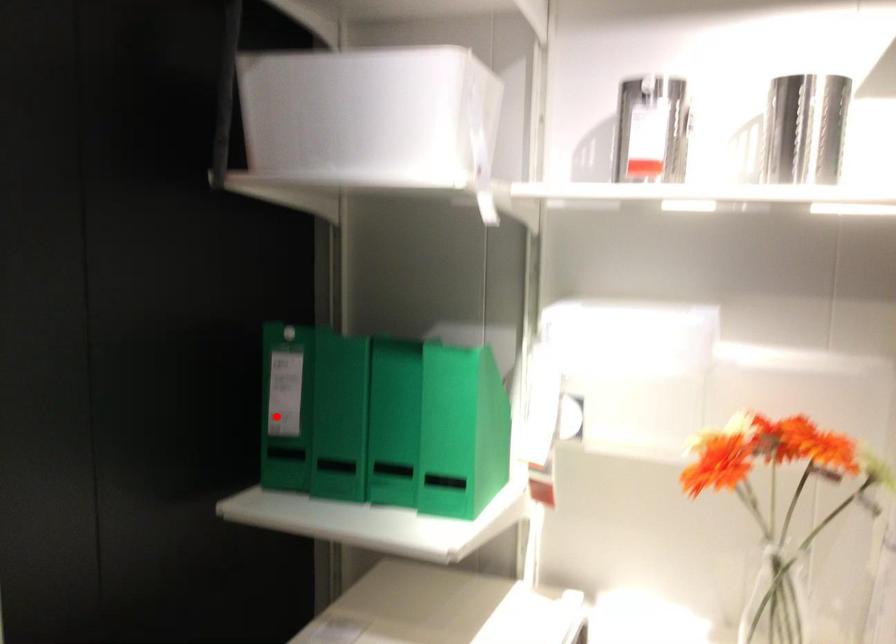
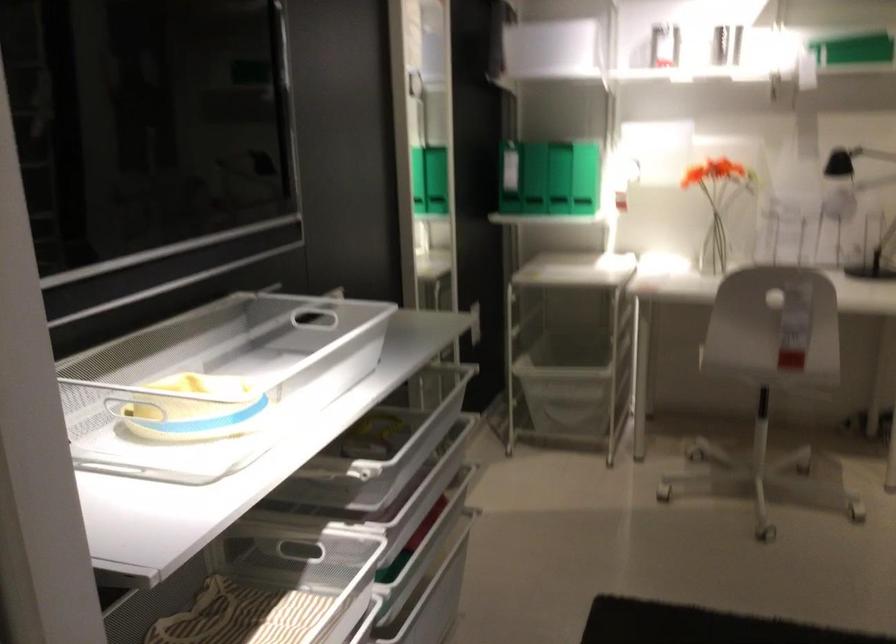
Where in the second image is the point corresponding to the highlighted location from the first image?

(511, 174)